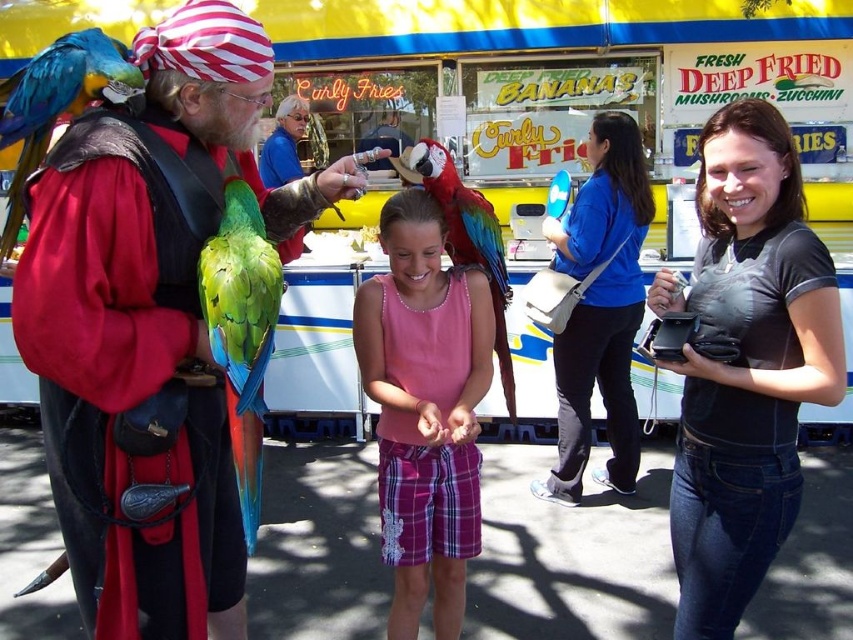
Question: Can you confirm if black matte purse at center is positioned above green matte parrot at left?

Choices:
 (A) yes
 (B) no

Answer: (B)

Question: Where is black matte purse at center located in relation to green matte parrot at left in the image?

Choices:
 (A) below
 (B) above

Answer: (A)

Question: Among these objects, which one is farthest from the camera?

Choices:
 (A) multicolored feathered parrot at center
 (B) blue fabric purse at center
 (C) black matte purse at center

Answer: (B)

Question: Which object is positioned closest to the black matte purse at center?

Choices:
 (A) blue-green feathered parrot at left
 (B) green matte parrot at left

Answer: (B)

Question: Which of the following is the farthest from the observer?

Choices:
 (A) green matte parrot at left
 (B) blue-green feathered parrot at left
 (C) multicolored feathered parrot at center

Answer: (C)

Question: Is pink fabric tank top at center to the right of blue-green feathered parrot at left from the viewer's perspective?

Choices:
 (A) yes
 (B) no

Answer: (A)